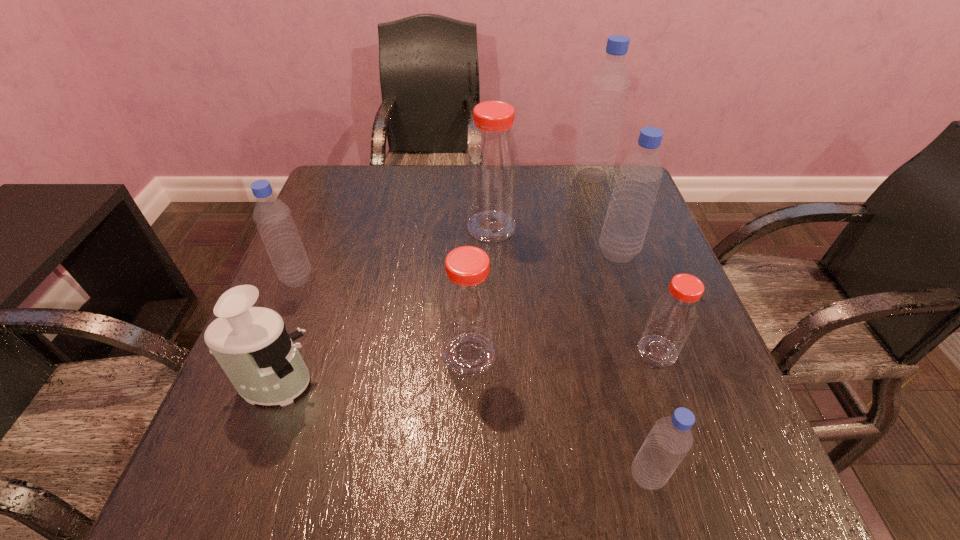
Find the location of `bottle that is at the left edge`. bottle that is at the left edge is located at coordinates point(273,218).

Identify the location of juicer that is at the left edge. (251, 344).

The width and height of the screenshot is (960, 540). In order to click on object that is positioned at the far right corner in this screenshot , I will do `click(609, 87)`.

The height and width of the screenshot is (540, 960). I want to click on object that is at the near right corner, so click(x=670, y=439).

Where is `vacant space at the far edge`? vacant space at the far edge is located at coordinates (439, 187).

The height and width of the screenshot is (540, 960). In the image, there is a desktop. Find the location of `vacant space at the near edge`. vacant space at the near edge is located at coordinates (609, 469).

I want to click on vacant space at the left edge of the desktop, so point(334,238).

The image size is (960, 540). In order to click on free point at the right edge in this screenshot , I will do `click(607, 268)`.

Where is `free spot at the far left corner of the desktop`? This screenshot has width=960, height=540. free spot at the far left corner of the desktop is located at coordinates (327, 174).

This screenshot has width=960, height=540. What are the coordinates of `vacant region at the near left corner` in the screenshot? It's located at (249, 450).